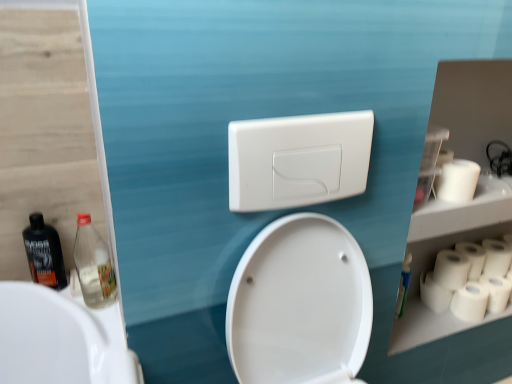
The image size is (512, 384). What do you see at coordinates (457, 181) in the screenshot?
I see `white matte toilet paper at right, which is the first toilet paper in top-to-bottom order` at bounding box center [457, 181].

Measure the distance between white matte toilet paper at right, arranged as the fourth toilet paper when ordered from the bottom, and camera.

white matte toilet paper at right, arranged as the fourth toilet paper when ordered from the bottom, and camera are 1.40 meters apart.

The width and height of the screenshot is (512, 384). Describe the element at coordinates (470, 302) in the screenshot. I see `white matte toilet paper at right, placed as the 1th toilet paper when sorted from bottom to top` at that location.

What do you see at coordinates (496, 257) in the screenshot? The image size is (512, 384). I see `white matte toilet paper at right, which ranks as the 2th toilet paper in top-to-bottom order` at bounding box center [496, 257].

This screenshot has width=512, height=384. Identify the location of white matte paper towel at right. (451, 269).

From the image's perspective, which is above, white matte toilet paper at right, the 5th toilet paper when ordered from top to bottom, or white matte toilet paper at right, which is the first toilet paper in top-to-bottom order?

white matte toilet paper at right, which is the first toilet paper in top-to-bottom order, appears higher in the image.

Is white matte toilet paper at right, the second toilet paper when ordered from bottom to top, bigger than white matte toilet paper at right, which is the first toilet paper in top-to-bottom order?

Actually, white matte toilet paper at right, the second toilet paper when ordered from bottom to top, might be smaller than white matte toilet paper at right, which is the first toilet paper in top-to-bottom order.

From a real-world perspective, which object stands above the other?

white matte toilet paper at right, which appears as the 6th toilet paper when ordered from the bottom.

At what (x,y) coordinates should I click in order to perform the action: click on the 3rd toilet paper behind the white matte toilet paper at right, which is the first toilet paper in top-to-bottom order, starting your count from the anchor. Please return your answer as a coordinate pair (x, y). The image size is (512, 384). Looking at the image, I should click on (496, 292).

Considering the relative sizes of white matte toilet paper at right, the 5th toilet paper when ordered from top to bottom, and white matte toilet paper at right, which ranks as the 2th toilet paper in top-to-bottom order, in the image provided, is white matte toilet paper at right, the 5th toilet paper when ordered from top to bottom, thinner than white matte toilet paper at right, which ranks as the 2th toilet paper in top-to-bottom order,?

Yes, white matte toilet paper at right, the 5th toilet paper when ordered from top to bottom, is thinner than white matte toilet paper at right, which ranks as the 2th toilet paper in top-to-bottom order.

How far apart are white matte toilet paper at right, the 5th toilet paper when ordered from top to bottom, and white matte toilet paper at right, which ranks as the 2th toilet paper in top-to-bottom order?

white matte toilet paper at right, the 5th toilet paper when ordered from top to bottom, and white matte toilet paper at right, which ranks as the 2th toilet paper in top-to-bottom order, are 7.02 centimeters apart.

Which object is positioned more to the left, white matte toilet paper at right, the 5th toilet paper when ordered from top to bottom, or white matte toilet paper at right, the fifth toilet paper when ordered from bottom to top?

white matte toilet paper at right, the 5th toilet paper when ordered from top to bottom, is more to the left.

From their relative heights in the image, would you say white matte toilet paper at right, the second toilet paper when ordered from bottom to top, is taller or shorter than white matte toilet paper at right, which ranks as the 2th toilet paper in top-to-bottom order?

Considering their sizes, white matte toilet paper at right, the second toilet paper when ordered from bottom to top, has less height than white matte toilet paper at right, which ranks as the 2th toilet paper in top-to-bottom order.

Is white matte paper towel at right surrounding white matte toilet paper at right, the 5th toilet paper when ordered from top to bottom?

No, white matte paper towel at right does not contain white matte toilet paper at right, the 5th toilet paper when ordered from top to bottom.

From a real-world perspective, is white matte paper towel at right positioned above or below white matte toilet paper at right, the 5th toilet paper when ordered from top to bottom?

Clearly, from a real-world perspective, white matte paper towel at right is above white matte toilet paper at right, the 5th toilet paper when ordered from top to bottom.

Considering the relative sizes of white matte paper towel at right and white matte toilet paper at right, the second toilet paper when ordered from bottom to top, in the image provided, is white matte paper towel at right wider than white matte toilet paper at right, the second toilet paper when ordered from bottom to top,?

Yes.

Image resolution: width=512 pixels, height=384 pixels. In order to click on paper towel above the white matte toilet paper at right, the second toilet paper when ordered from bottom to top (from the image's perspective) in this screenshot , I will do `click(451, 269)`.

From the image's perspective, which is below, matte black bottle at left, which is counted as the first bottle, starting from the left, or white plastic switch at upper center?

matte black bottle at left, which is counted as the first bottle, starting from the left, from the image's perspective.

Can you see matte black bottle at left, arranged as the second bottle when viewed from the right, touching white plastic switch at upper center?

No, matte black bottle at left, arranged as the second bottle when viewed from the right, is not beside white plastic switch at upper center.

From a real-world perspective, is matte black bottle at left, arranged as the second bottle when viewed from the right, physically located above or below white plastic switch at upper center?

From a real-world perspective, matte black bottle at left, arranged as the second bottle when viewed from the right, is physically below white plastic switch at upper center.

Is matte black bottle at left, arranged as the second bottle when viewed from the right, to the left of white plastic switch at upper center from the viewer's perspective?

Yes.

Is white matte toilet paper at right, arranged as the sixth toilet paper when viewed from the top, at the back of clear plastic bottle at left, which is the first bottle in right-to-left order?

No, clear plastic bottle at left, which is the first bottle in right-to-left order, is not facing away from white matte toilet paper at right, arranged as the sixth toilet paper when viewed from the top.

From the image's perspective, relative to white matte toilet paper at right, arranged as the sixth toilet paper when viewed from the top, is clear plastic bottle at left, placed as the 2th bottle when sorted from left to right, above or below?

Based on their image positions, clear plastic bottle at left, placed as the 2th bottle when sorted from left to right, is located above white matte toilet paper at right, arranged as the sixth toilet paper when viewed from the top.

Which point is more distant from viewer, (108,290) or (460,304)?

Point (460,304)

Considering the sizes of objects white matte toilet paper at right, arranged as the sixth toilet paper when viewed from the top, and white matte toilet paper at right, arranged as the fourth toilet paper when ordered from the bottom, in the image provided, who is smaller, white matte toilet paper at right, arranged as the sixth toilet paper when viewed from the top, or white matte toilet paper at right, arranged as the fourth toilet paper when ordered from the bottom,?

Smaller between the two is white matte toilet paper at right, arranged as the sixth toilet paper when viewed from the top.

From a real-world perspective, between white matte toilet paper at right, placed as the 1th toilet paper when sorted from bottom to top, and white matte toilet paper at right, arranged as the fourth toilet paper when ordered from the bottom, who is vertically lower?

From a 3D spatial view, white matte toilet paper at right, placed as the 1th toilet paper when sorted from bottom to top, is below.

Locate an element on the screen. the 3rd toilet paper above the white matte toilet paper at right, arranged as the sixth toilet paper when viewed from the top (from the image's perspective) is located at coordinates (472, 258).

Which object is wider, white matte toilet paper at right, arranged as the sixth toilet paper when viewed from the top, or white matte toilet paper at right, arranged as the 3th toilet paper when viewed from the top?

Wider between the two is white matte toilet paper at right, arranged as the 3th toilet paper when viewed from the top.

Is white matte toilet paper at right, the second toilet paper when ordered from bottom to top, outside of white plastic switch at upper center?

Indeed, white matte toilet paper at right, the second toilet paper when ordered from bottom to top, is completely outside white plastic switch at upper center.

Based on the photo, from a real-world perspective, is white matte toilet paper at right, the second toilet paper when ordered from bottom to top, over white plastic switch at upper center?

No, from a real-world perspective, white matte toilet paper at right, the second toilet paper when ordered from bottom to top, is not above white plastic switch at upper center.

Is the depth of white matte toilet paper at right, the second toilet paper when ordered from bottom to top, greater than that of white plastic switch at upper center?

Yes, the depth of white matte toilet paper at right, the second toilet paper when ordered from bottom to top, is greater than that of white plastic switch at upper center.

In order to click on toilet paper that is the 4th object located below the white matte toilet paper at right, which appears as the 6th toilet paper when ordered from the bottom (from the image's perspective) in this screenshot , I will do `click(496, 292)`.

The image size is (512, 384). In order to click on toilet paper that is the 1st one when counting leftward from the white matte toilet paper at right, which ranks as the 2th toilet paper in top-to-bottom order in this screenshot , I will do `click(496, 292)`.

Considering their positions, is white matte paper towel at right positioned further to white matte toilet paper at right, the second toilet paper when ordered from bottom to top, than white matte toilet paper at right, placed as the 1th toilet paper when sorted from bottom to top?

white matte paper towel at right lies further to white matte toilet paper at right, the second toilet paper when ordered from bottom to top, than the other object.

Based on their spatial positions, is white matte toilet paper at right, placed as the 1th toilet paper when sorted from bottom to top, or white matte toilet paper at right, the second toilet paper when ordered from bottom to top, further from matte black bottle at left, arranged as the second bottle when viewed from the right?

white matte toilet paper at right, the second toilet paper when ordered from bottom to top, is positioned further to the anchor matte black bottle at left, arranged as the second bottle when viewed from the right.

When comparing their distances from white matte toilet paper at right, placed as the 1th toilet paper when sorted from bottom to top, does matte black bottle at left, arranged as the second bottle when viewed from the right, or white plastic switch at upper center seem further?

Based on the image, matte black bottle at left, arranged as the second bottle when viewed from the right, appears to be further to white matte toilet paper at right, placed as the 1th toilet paper when sorted from bottom to top.

From the image, which object appears to be nearer to white matte toilet paper at right, placed as the 1th toilet paper when sorted from bottom to top, white plastic switch at upper center or white matte toilet paper at right, placed as the 3th toilet paper when sorted from bottom to top?

white matte toilet paper at right, placed as the 3th toilet paper when sorted from bottom to top.

When comparing their distances from matte black bottle at left, arranged as the second bottle when viewed from the right, does white matte toilet paper at right, which appears as the 6th toilet paper when ordered from the bottom, or white matte toilet paper at right, the second toilet paper when ordered from bottom to top, seem closer?

white matte toilet paper at right, which appears as the 6th toilet paper when ordered from the bottom, is positioned closer to the anchor matte black bottle at left, arranged as the second bottle when viewed from the right.

When comparing their distances from white matte paper towel at right, does white matte toilet paper at right, arranged as the 3th toilet paper when viewed from the top, or white matte toilet paper at right, arranged as the sixth toilet paper when viewed from the top, seem further?

The object further to white matte paper towel at right is white matte toilet paper at right, arranged as the sixth toilet paper when viewed from the top.

Based on their spatial positions, is white matte toilet paper at right, which appears as the 6th toilet paper when ordered from the bottom, or white matte paper towel at right further from matte black bottle at left, arranged as the second bottle when viewed from the right?

white matte paper towel at right.

Which object lies further to the anchor point white matte toilet paper at right, which ranks as the 2th toilet paper in top-to-bottom order, matte black bottle at left, arranged as the second bottle when viewed from the right, or white matte toilet paper at right, arranged as the fourth toilet paper when ordered from the bottom?

Among the two, matte black bottle at left, arranged as the second bottle when viewed from the right, is located further to white matte toilet paper at right, which ranks as the 2th toilet paper in top-to-bottom order.

Find the location of a particular element. The width and height of the screenshot is (512, 384). paper towel located between clear plastic bottle at left, which is the first bottle in right-to-left order, and white matte toilet paper at right, which ranks as the 2th toilet paper in top-to-bottom order, in the left-right direction is located at coordinates (451, 269).

Find the location of `paper towel that lies between white matte toilet paper at right, which appears as the 6th toilet paper when ordered from the bottom, and white matte toilet paper at right, the 5th toilet paper when ordered from top to bottom, from top to bottom`. paper towel that lies between white matte toilet paper at right, which appears as the 6th toilet paper when ordered from the bottom, and white matte toilet paper at right, the 5th toilet paper when ordered from top to bottom, from top to bottom is located at coordinates (451, 269).

Image resolution: width=512 pixels, height=384 pixels. I want to click on toilet paper between matte black bottle at left, arranged as the second bottle when viewed from the right, and white matte toilet paper at right, which is the 4th toilet paper in top-to-bottom order, in the horizontal direction, so click(x=457, y=181).

The height and width of the screenshot is (384, 512). What are the coordinates of `paper towel between white plastic switch at upper center and white matte toilet paper at right, placed as the 3th toilet paper when sorted from bottom to top, in the front-back direction` in the screenshot? It's located at (451, 269).